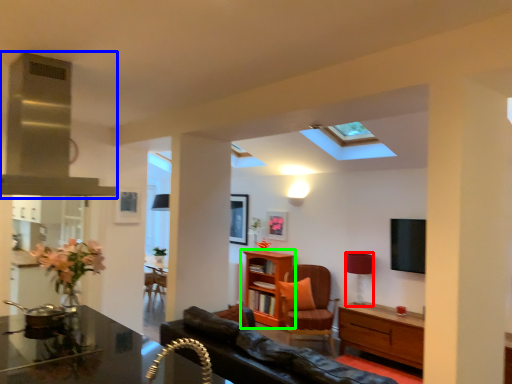
Question: Which object is positioned farthest from lamp (highlighted by a red box)? Select from exhaust hood (highlighted by a blue box) and shelf (highlighted by a green box).

Choices:
 (A) exhaust hood
 (B) shelf

Answer: (A)